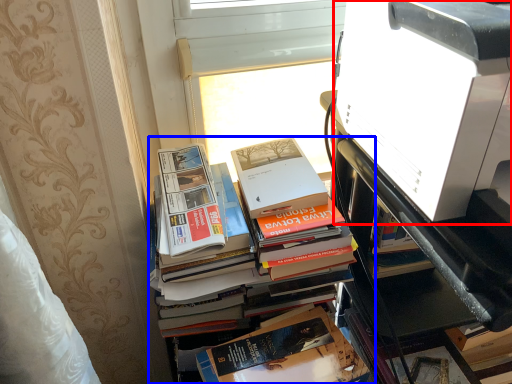
Question: Which of the following is the closest to the observer, printer (highlighted by a red box) or book (highlighted by a blue box)?

Choices:
 (A) printer
 (B) book

Answer: (A)